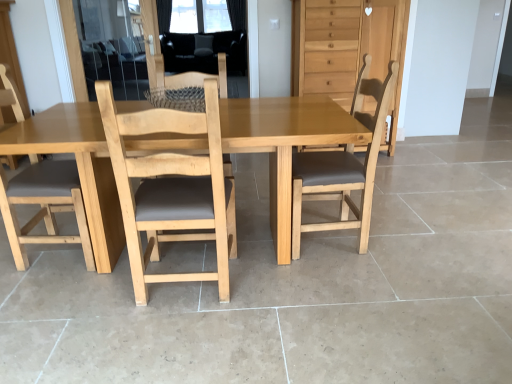
The image size is (512, 384). What are the coordinates of `light brown wooden table at center` in the screenshot? It's located at (285, 144).

Identify the location of light brown wood chair at left, which is the third chair from right to left. The image size is (512, 384). coord(44,206).

The image size is (512, 384). Describe the element at coordinates (111, 45) in the screenshot. I see `transparent glass screen door at upper left` at that location.

How much space does light wood chair at center, which is counted as the third chair, starting from the left, occupy horizontally?

light wood chair at center, which is counted as the third chair, starting from the left, is 19.62 inches in width.

Where is `light brown wood chair at left, the 1th chair in the left-to-right sequence`? The height and width of the screenshot is (384, 512). light brown wood chair at left, the 1th chair in the left-to-right sequence is located at coordinates (11, 93).

This screenshot has width=512, height=384. Describe the element at coordinates (11, 93) in the screenshot. I see `light brown wood chair at left, acting as the fourth chair starting from the right` at that location.

This screenshot has width=512, height=384. Identify the location of light brown wooden table at center. (285, 144).

From the image's perspective, which object appears higher, light brown wood chair at left, the 1th chair in the left-to-right sequence, or transparent plastic window screen at upper center?

transparent plastic window screen at upper center appears higher in the image.

Are light brown wood chair at left, acting as the fourth chair starting from the right, and transparent plastic window screen at upper center located far from each other?

Yes.

From a real-world perspective, which is physically below, light brown wood chair at left, acting as the fourth chair starting from the right, or transparent plastic window screen at upper center?

light brown wood chair at left, acting as the fourth chair starting from the right, from a real-world perspective.

From their relative heights in the image, would you say light wood chair at center, acting as the 2th chair starting from the right, is taller or shorter than light brown wooden table at center?

light wood chair at center, acting as the 2th chair starting from the right, is taller than light brown wooden table at center.

From the image's perspective, which is above, light wood chair at center, which is counted as the third chair, starting from the left, or light brown wooden table at center?

From the image's view, light brown wooden table at center is above.

Does light wood chair at center, which is counted as the third chair, starting from the left, lie in front of light brown wooden table at center?

Yes.

Is light brown wood chair at left, acting as the fourth chair starting from the right, positioned beyond the bounds of light brown wooden dresser at upper right?

That's correct, light brown wood chair at left, acting as the fourth chair starting from the right, is outside of light brown wooden dresser at upper right.

Between light brown wood chair at left, acting as the fourth chair starting from the right, and light brown wooden dresser at upper right, which one is positioned in front?

light brown wood chair at left, acting as the fourth chair starting from the right.

Based on the photo, who is smaller, light brown wood chair at left, the 1th chair in the left-to-right sequence, or light brown wooden dresser at upper right?

light brown wood chair at left, the 1th chair in the left-to-right sequence, is smaller.

Does light brown wood chair at left, the 1th chair in the left-to-right sequence, have a lesser height compared to light brown wooden dresser at upper right?

No, light brown wood chair at left, the 1th chair in the left-to-right sequence, is not shorter than light brown wooden dresser at upper right.

Identify the location of table located underneath the transparent plastic window screen at upper center (from a real-world perspective). (285, 144).

Does point (139, 102) come in front of point (194, 16)?

Yes, it is in front of point (194, 16).

From the image's perspective, relative to transparent plastic window screen at upper center, is light brown wooden table at center above or below?

Based on their image positions, light brown wooden table at center is located beneath transparent plastic window screen at upper center.

Is light brown wood chair at left, acting as the fourth chair starting from the right, wider or thinner than light brown wood chair at left, which is the third chair from right to left?

light brown wood chair at left, acting as the fourth chair starting from the right, is wider than light brown wood chair at left, which is the third chair from right to left.

Is light brown wood chair at left, acting as the fourth chair starting from the right, far from light brown wood chair at left, which is the third chair from right to left?

Actually, light brown wood chair at left, acting as the fourth chair starting from the right, and light brown wood chair at left, which is the third chair from right to left, are a little close together.

Can you confirm if light brown wood chair at left, acting as the fourth chair starting from the right, is shorter than light brown wood chair at left, which is the third chair from right to left?

No.

From the picture: Considering the relative positions of light brown wood chair at left, acting as the fourth chair starting from the right, and light brown wood chair at left, positioned as the 2th chair in left-to-right order, in the image provided, is light brown wood chair at left, acting as the fourth chair starting from the right, to the left of light brown wood chair at left, positioned as the 2th chair in left-to-right order, from the viewer's perspective?

Indeed, light brown wood chair at left, acting as the fourth chair starting from the right, is positioned on the left side of light brown wood chair at left, positioned as the 2th chair in left-to-right order.

Which object is more forward, light brown wooden dresser at upper right or light brown wood chair at left, acting as the fourth chair starting from the right?

light brown wood chair at left, acting as the fourth chair starting from the right, is closer to the camera.

Based on the photo, considering the sizes of objects light brown wooden dresser at upper right and light brown wood chair at left, acting as the fourth chair starting from the right, in the image provided, who is taller, light brown wooden dresser at upper right or light brown wood chair at left, acting as the fourth chair starting from the right,?

Standing taller between the two is light brown wood chair at left, acting as the fourth chair starting from the right.

In the scene shown: Does light brown wooden dresser at upper right appear on the right side of light brown wood chair at left, acting as the fourth chair starting from the right?

Correct, you'll find light brown wooden dresser at upper right to the right of light brown wood chair at left, acting as the fourth chair starting from the right.

Based on the photo, from the image's perspective, who appears lower, light brown wooden dresser at upper right or light brown wood chair at left, acting as the fourth chair starting from the right?

light brown wood chair at left, acting as the fourth chair starting from the right, is shown below in the image.

Is light brown wooden dresser at upper right bigger than light wood chair at center, acting as the 2th chair starting from the right?

Indeed, light brown wooden dresser at upper right has a larger size compared to light wood chair at center, acting as the 2th chair starting from the right.

Do you think light brown wooden dresser at upper right is within light wood chair at center, which is counted as the third chair, starting from the left, or outside of it?

light brown wooden dresser at upper right is spatially situated outside light wood chair at center, which is counted as the third chair, starting from the left.

Is light brown wooden dresser at upper right wider than light wood chair at center, which is counted as the third chair, starting from the left?

Correct, the width of light brown wooden dresser at upper right exceeds that of light wood chair at center, which is counted as the third chair, starting from the left.

Does light brown wooden dresser at upper right appear on the left side of light wood chair at center, acting as the 2th chair starting from the right?

No.

Find the location of a particular element. window screen above the light brown wood chair at left, acting as the fourth chair starting from the right (from the image's perspective) is located at coordinates (184, 17).

Where is `chair in front of the light brown wooden table at center`? The width and height of the screenshot is (512, 384). chair in front of the light brown wooden table at center is located at coordinates (170, 188).

When comparing their distances from light brown wood chair at center, which is the 4th chair in left-to-right order, does light brown wooden table at center or transparent glass screen door at upper left seem closer?

light brown wooden table at center is positioned closer to the anchor light brown wood chair at center, which is the 4th chair in left-to-right order.

When comparing their distances from transparent glass screen door at upper left, does light brown wood chair at center, which ranks as the 1th chair in right-to-left order, or light brown wood chair at left, the 1th chair in the left-to-right sequence, seem further?

light brown wood chair at center, which ranks as the 1th chair in right-to-left order.

Based on their spatial positions, is light brown wood chair at left, acting as the fourth chair starting from the right, or light brown wood chair at center, which ranks as the 1th chair in right-to-left order, further from light brown wood chair at left, which is the third chair from right to left?

light brown wood chair at center, which ranks as the 1th chair in right-to-left order, is positioned further to the anchor light brown wood chair at left, which is the third chair from right to left.

Which object lies nearer to the anchor point transparent glass screen door at upper left, light brown wood chair at left, acting as the fourth chair starting from the right, or light brown wood chair at center, which is the 4th chair in left-to-right order?

light brown wood chair at left, acting as the fourth chair starting from the right, is closer to transparent glass screen door at upper left.

Based on their spatial positions, is light brown wooden dresser at upper right or light brown wood chair at left, acting as the fourth chair starting from the right, further from light brown wooden table at center?

The object further to light brown wooden table at center is light brown wooden dresser at upper right.

When comparing their distances from transparent plastic window screen at upper center, does light brown wood chair at left, positioned as the 2th chair in left-to-right order, or light brown wood chair at center, which ranks as the 1th chair in right-to-left order, seem further?

Based on the image, light brown wood chair at left, positioned as the 2th chair in left-to-right order, appears to be further to transparent plastic window screen at upper center.

Which object lies nearer to the anchor point transparent plastic window screen at upper center, transparent glass screen door at upper left or light brown wood chair at center, which ranks as the 1th chair in right-to-left order?

transparent glass screen door at upper left is positioned closer to the anchor transparent plastic window screen at upper center.

Based on their spatial positions, is light brown wood chair at left, acting as the fourth chair starting from the right, or light brown wooden table at center further from light brown wooden dresser at upper right?

The object further to light brown wooden dresser at upper right is light brown wood chair at left, acting as the fourth chair starting from the right.

At what (x,y) coordinates should I click in order to perform the action: click on screen door positioned between light wood chair at center, acting as the 2th chair starting from the right, and transparent plastic window screen at upper center from near to far. Please return your answer as a coordinate pair (x, y). The width and height of the screenshot is (512, 384). Looking at the image, I should click on (111, 45).

The height and width of the screenshot is (384, 512). What are the coordinates of `screen door positioned between light brown wooden table at center and transparent plastic window screen at upper center from near to far` in the screenshot? It's located at (111, 45).

The width and height of the screenshot is (512, 384). I want to click on screen door positioned between light brown wood chair at left, the 1th chair in the left-to-right sequence, and transparent plastic window screen at upper center from near to far, so click(111, 45).

This screenshot has width=512, height=384. I want to click on table between light wood chair at center, which is counted as the third chair, starting from the left, and transparent plastic window screen at upper center, along the z-axis, so click(285, 144).